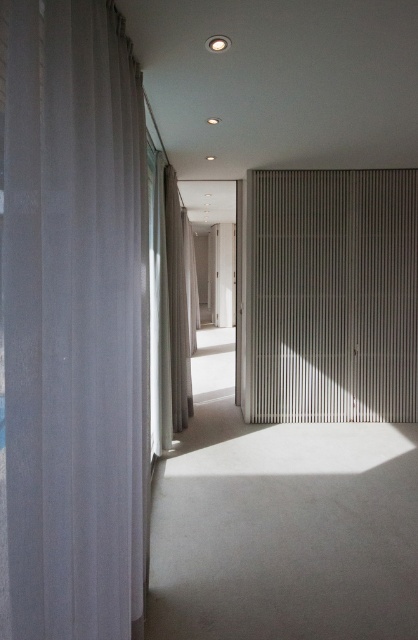
Does sheer white curtain at left lie in front of metallic silver blinds at right?

Yes, it is in front of metallic silver blinds at right.

Between sheer white curtain at left and metallic silver blinds at right, which one is positioned higher?

metallic silver blinds at right

Between point (69, 461) and point (277, 396), which one is positioned behind?

The point (277, 396) is behind.

The height and width of the screenshot is (640, 418). In order to click on sheer white curtain at left in this screenshot , I will do click(73, 321).

Between point (334, 211) and point (213, 268), which one is positioned behind?

Point (213, 268)

Does metallic silver blinds at right have a greater width compared to clear glass screen door at center?

Yes, metallic silver blinds at right is wider than clear glass screen door at center.

Locate an element on the screen. This screenshot has width=418, height=640. metallic silver blinds at right is located at coordinates (333, 294).

Does sheer white curtain at left have a larger size compared to white sheer curtain at left?

No, sheer white curtain at left is not bigger than white sheer curtain at left.

Is sheer white curtain at left further to the viewer compared to white sheer curtain at left?

No.

Which is in front, point (37, 0) or point (181, 388)?

Point (37, 0) is in front.

At what (x,y) coordinates should I click in order to perform the action: click on sheer white curtain at left. Please return your answer as a coordinate pair (x, y). Looking at the image, I should click on (73, 321).